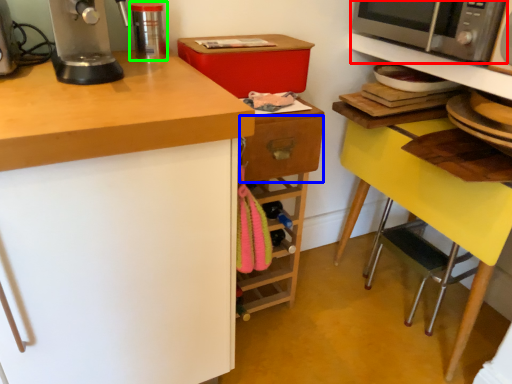
Question: Based on their relative distances, which object is farther from microwave oven (highlighted by a red box)? Choose from drawer (highlighted by a blue box) and kitchen appliance (highlighted by a green box).

Choices:
 (A) drawer
 (B) kitchen appliance

Answer: (B)